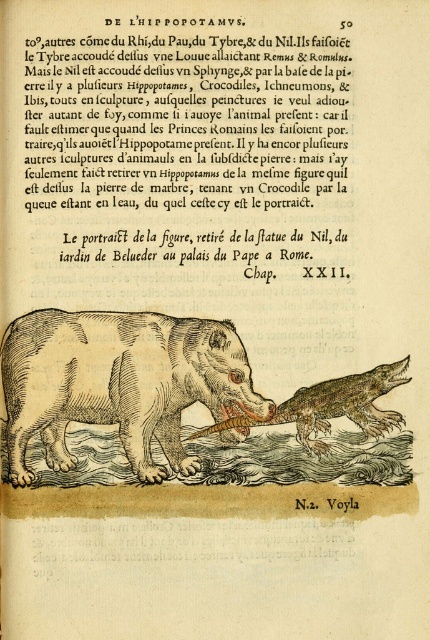
Question: Which point is farther to the camera?

Choices:
 (A) (141, 348)
 (B) (346, 376)

Answer: (B)

Question: Does brown wood carving hippopotamus at center appear on the left side of brown textured crocodile at center?

Choices:
 (A) no
 (B) yes

Answer: (B)

Question: Does black wood text at upper center appear on the right side of brown textured crocodile at center?

Choices:
 (A) no
 (B) yes

Answer: (A)

Question: Which object is positioned farthest from the brown textured crocodile at center?

Choices:
 (A) brown wood carving hippopotamus at center
 (B) black wood text at upper center

Answer: (B)

Question: Is black wood text at upper center behind brown wood carving hippopotamus at center?

Choices:
 (A) yes
 (B) no

Answer: (B)

Question: Estimate the real-world distances between objects in this image. Which object is closer to the brown textured crocodile at center?

Choices:
 (A) black wood text at upper center
 (B) brown wood carving hippopotamus at center

Answer: (B)